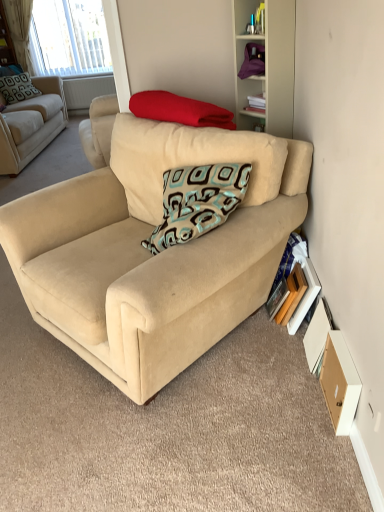
Where is `space that is in front of beige velvety couch at center, which is the first studio couch in right-to-left order`? Image resolution: width=384 pixels, height=512 pixels. space that is in front of beige velvety couch at center, which is the first studio couch in right-to-left order is located at coordinates (171, 442).